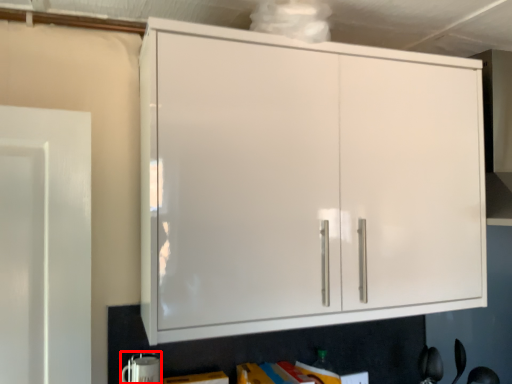
Question: Observing the image, what is the correct spatial positioning of appliance (annotated by the red box) in reference to cupboard?

Choices:
 (A) left
 (B) right

Answer: (A)